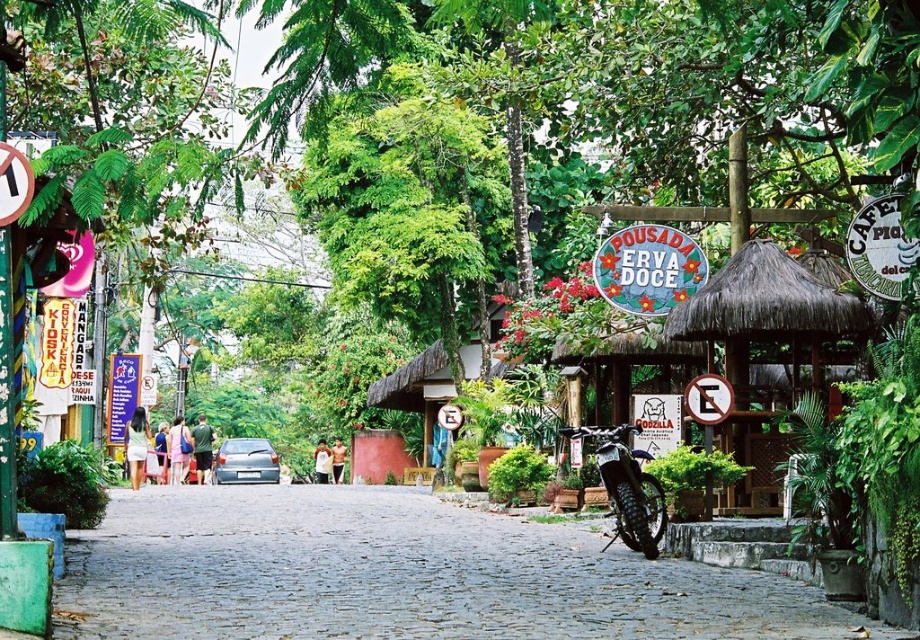
You are a visitor at the resort and want to take a photo of the thatched roof hut at center and the metallic silver motorcycle at center. Which object should you focus on first if you want to capture both in the same frame without moving the camera?

You should focus on the metallic silver motorcycle at center first because the thatched roof hut at center is located above it, so adjusting the camera to include the upper area will naturally include both objects in the frame.

You are standing at the entrance of the resort and want to find the thatched roof hut at center. According to the map coordinates, where should you look?

The thatched roof hut at center is located at coordinates point (x=763, y=308).